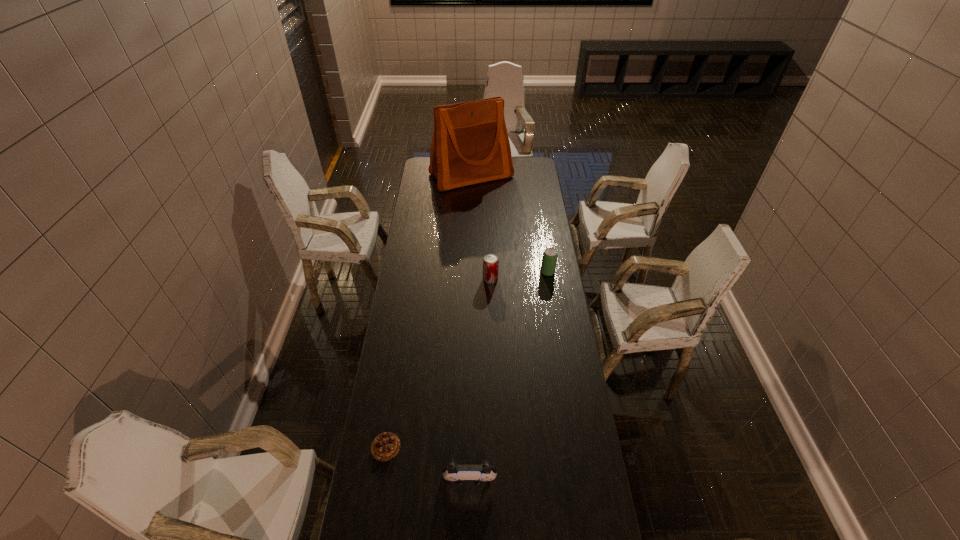
Image resolution: width=960 pixels, height=540 pixels. I want to click on free space between the left soda can and the control, so click(480, 380).

Locate an element on the screen. The width and height of the screenshot is (960, 540). vacant area between the right soda can and the shopping bag is located at coordinates coord(510,224).

This screenshot has height=540, width=960. In order to click on free space that is in between the second nearest object and the nearest object in this screenshot , I will do tap(427, 463).

You are a GUI agent. You are given a task and a screenshot of the screen. Output one action in this format:
    pyautogui.click(x=<x>, y=<y>)
    Task: Click on the vacant space that is in between the nearest object and the farthest object
    The width and height of the screenshot is (960, 540).
    Given the screenshot: What is the action you would take?
    pyautogui.click(x=470, y=328)

At what (x,y) coordinates should I click in order to perform the action: click on free space between the left soda can and the nearest object. Please return your answer as a coordinate pair (x, y). The height and width of the screenshot is (540, 960). Looking at the image, I should click on (480, 380).

I want to click on free space between the shopping bag and the left soda can, so click(481, 227).

Locate an element on the screen. free space between the rightmost object and the left soda can is located at coordinates (519, 275).

Locate an element on the screen. The image size is (960, 540). free spot between the left soda can and the control is located at coordinates (480, 380).

Find the location of a particular element. The width and height of the screenshot is (960, 540). vacant region between the left soda can and the tallest object is located at coordinates (481, 227).

I want to click on free area in between the tallest object and the left soda can, so click(x=481, y=227).